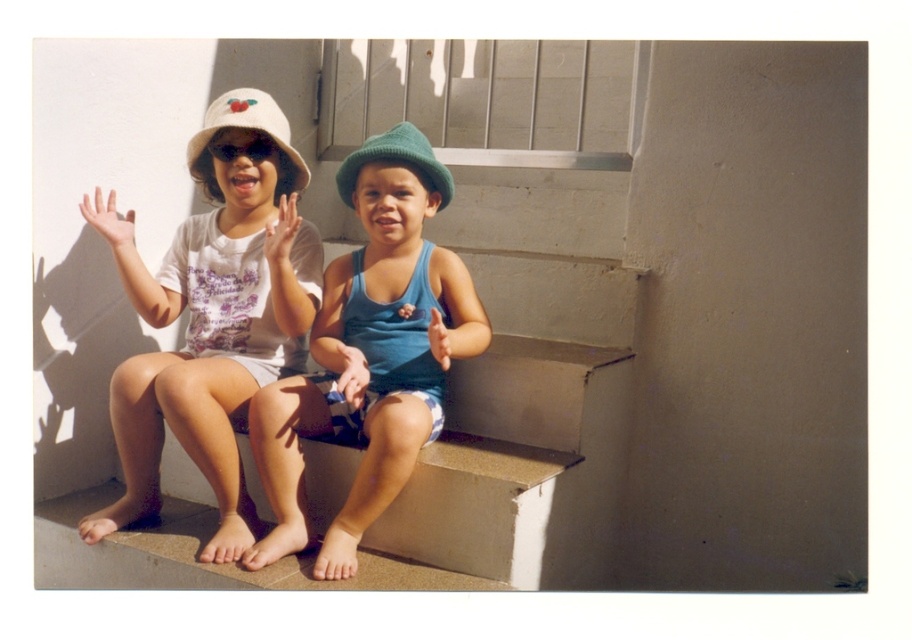
Does point (116, 228) lie behind point (285, 257)?

Yes, point (116, 228) is behind point (285, 257).

Is the position of white matte hand at center less distant than that of matte white hand at center?

No, it is not.

Which is behind, point (114, 202) or point (266, 234)?

Point (114, 202)

Find the location of a particular element. This screenshot has height=640, width=912. white matte hand at center is located at coordinates (109, 220).

Between point (472, 540) and point (295, 211), which one is positioned behind?

Positioned behind is point (295, 211).

Between smooth concrete stairs at center and matte white hand at center, which one is positioned higher?

matte white hand at center is higher up.

What do you see at coordinates (525, 394) in the screenshot? The image size is (912, 640). I see `smooth concrete stairs at center` at bounding box center [525, 394].

Identify the location of smooth concrete stairs at center. (525, 394).

Consider the image. Is white matte baseball hat at upper left positioned behind smooth blue fabric at center?

Yes, white matte baseball hat at upper left is further from the viewer.

Is point (246, 125) in front of point (339, 376)?

No, (246, 125) is behind (339, 376).

At what (x,y) coordinates should I click in order to perform the action: click on white matte baseball hat at upper left. Please return your answer as a coordinate pair (x, y). Looking at the image, I should click on (247, 125).